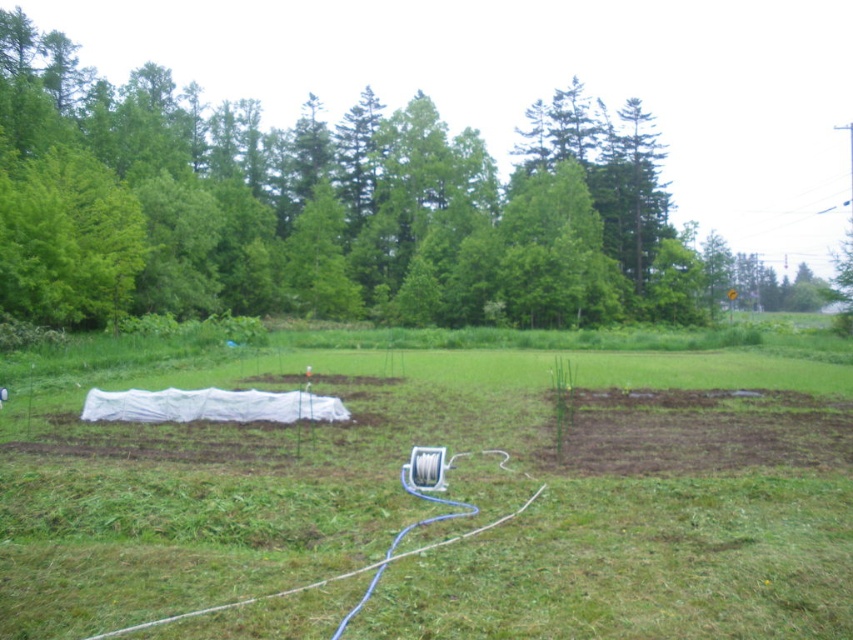
You are a farmer planning to install an irrigation system between the white fabric at center and the green leafy tree at upper center. The system requires a minimum distance of 50 meters between the two points for proper installation. Can the system be installed based on the current layout?

The white fabric at center is 65.26 meters away from the green leafy tree at upper center. Since 65.26 meters exceeds the minimum required distance of 50 meters, the irrigation system can be installed between them.

You are a farmer planning to plant a row of sunflowers between the white fabric at center and the green leafy tree at upper center. Which object should you place the sunflowers closer to so they receive more sunlight, considering their spacing requirements?

The white fabric at center has a smaller size compared to green leafy tree at upper center, so placing the sunflowers closer to the green leafy tree at upper center would allow them to receive more sunlight as the tree might provide shade, but since the question is about receiving more sunlight, you should place them closer to the white fabric at center which is smaller and less obstructive.

You are a gardener planning to water the white fabric at center and the green leafy tree at upper center. Which object is closer to the ground?

The white fabric at center is closer to the ground than the green leafy tree at upper center because it is located below it.